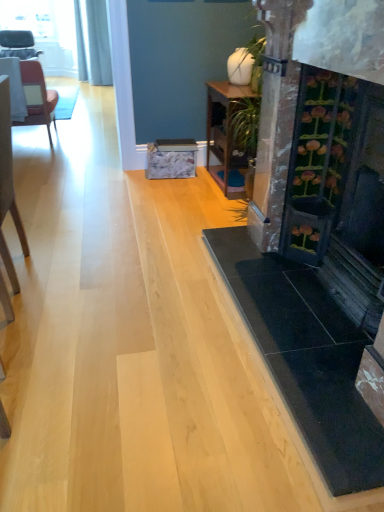
Question: From a real-world perspective, is matte black chair at upper left, which ranks as the first chair in top-to-bottom order, physically located above or below matte brown chair at left, arranged as the second chair when viewed from the top?

Choices:
 (A) below
 (B) above

Answer: (B)

Question: Relative to matte brown chair at left, which ranks as the 2th chair in back-to-front order, is matte black chair at upper left, which ranks as the first chair in top-to-bottom order, in front or behind?

Choices:
 (A) front
 (B) behind

Answer: (B)

Question: Which object is the farthest from the white fabric table at left, the 2th table positioned from the right?

Choices:
 (A) matte brown chair at left, placed as the second chair when sorted from left to right
 (B) wooden table at center, marked as the second table in a top-to-bottom arrangement
 (C) matte black chair at upper left, the 3th chair from the front
 (D) light brown wooden chair at left, the first chair in the bottom-to-top sequence
 (E) dark wood fireplace at right

Answer: (E)

Question: Estimate the real-world distances between objects in this image. Which object is closer to the matte brown chair at left, which is counted as the second chair, starting from the right?

Choices:
 (A) light brown wooden chair at left, acting as the 3th chair starting from the back
 (B) white fabric table at left, arranged as the 2th table when ordered from the bottom
 (C) matte black chair at upper left, the third chair from the right
 (D) wooden table at center, which is the second table in left-to-right order
 (E) dark wood fireplace at right

Answer: (B)